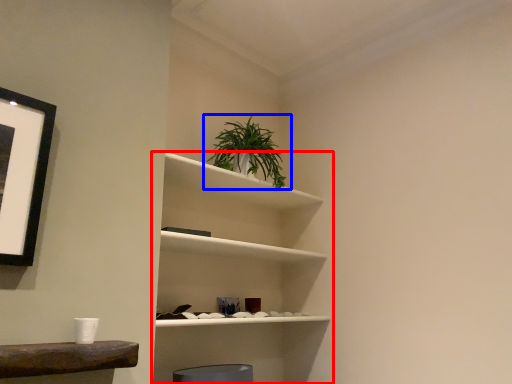
Question: Which object is further to the camera taking this photo, shelf (highlighted by a red box) or houseplant (highlighted by a blue box)?

Choices:
 (A) shelf
 (B) houseplant

Answer: (B)